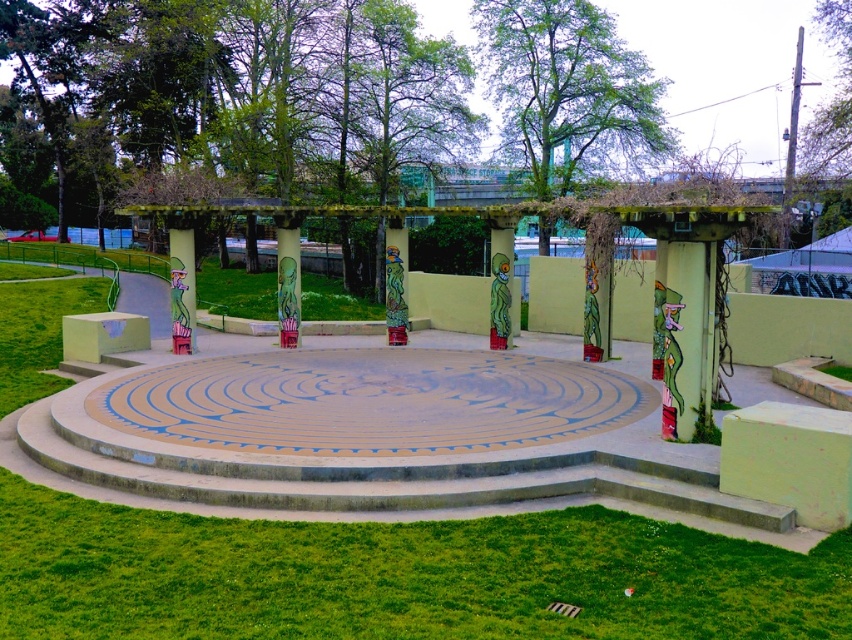
You are standing at the entrance of the labyrinth and see two points marked on the ground. The first point is at coordinate point (663, 628) and the second is at point (692, 278). If you want to reach the point that is closer to the entrance, which coordinate should you go to?

Point (692, 278) is closer to the entrance because it is behind point (663, 628), meaning it is nearer to the entrance.